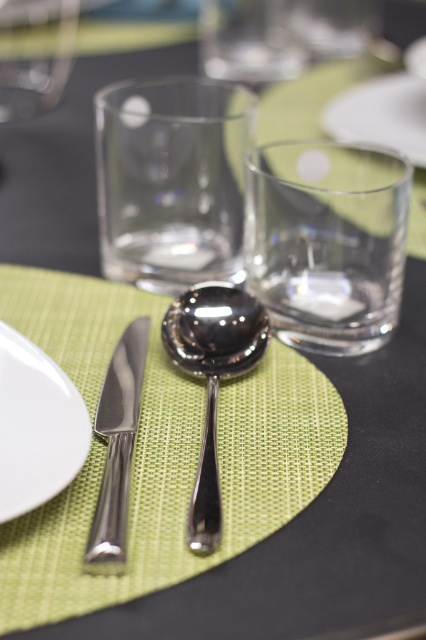
You are setting up a table for a formal dinner. You have a polished silver spoon at center and a polished metal knife at left. Which item would cast a longer shadow if the light source is directly above them?

The polished silver spoon at center is much taller than the polished metal knife at left, so it would cast a longer shadow.

You are taking a photo of the table setting and notice two points on the table surface. The first point is at coordinates point (23, 406) and the second is at point (215, 509). Which point is closer to the camera?

Point (23, 406) is closer to the camera than point (215, 509).

Based on the photo, you are setting up a table for a dinner party and need to place a decorative napkin between the white glossy plate at lower left and the polished silver spoon at center. Given their sizes, which item should the napkin be placed closer to to ensure it doesn

The white glossy plate at lower left has a lesser width compared to the polished silver spoon at center. Therefore, the napkin should be placed closer to the polished silver spoon at center to ensure it accommodates both items properly.